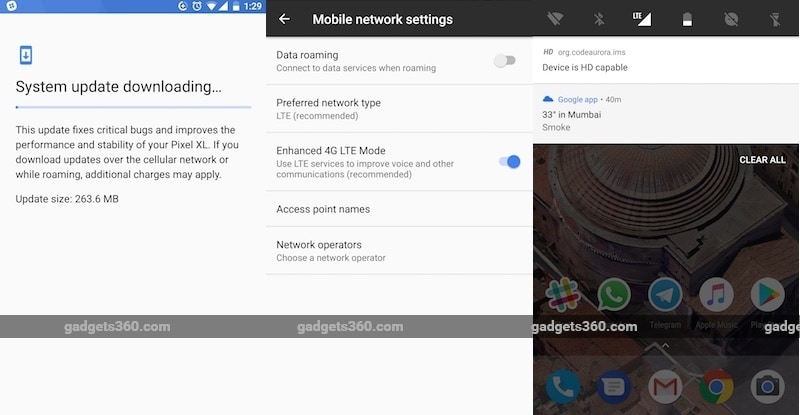
Locate an element on the screen. This screenshot has height=415, width=800. off toggle switch is located at coordinates (506, 63).